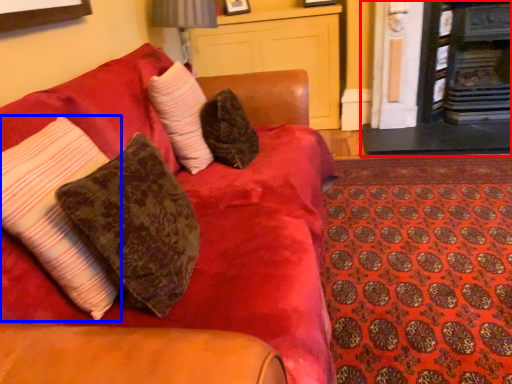
Question: Which object is closer to the camera taking this photo, fireplace (highlighted by a red box) or pillow (highlighted by a blue box)?

Choices:
 (A) fireplace
 (B) pillow

Answer: (B)